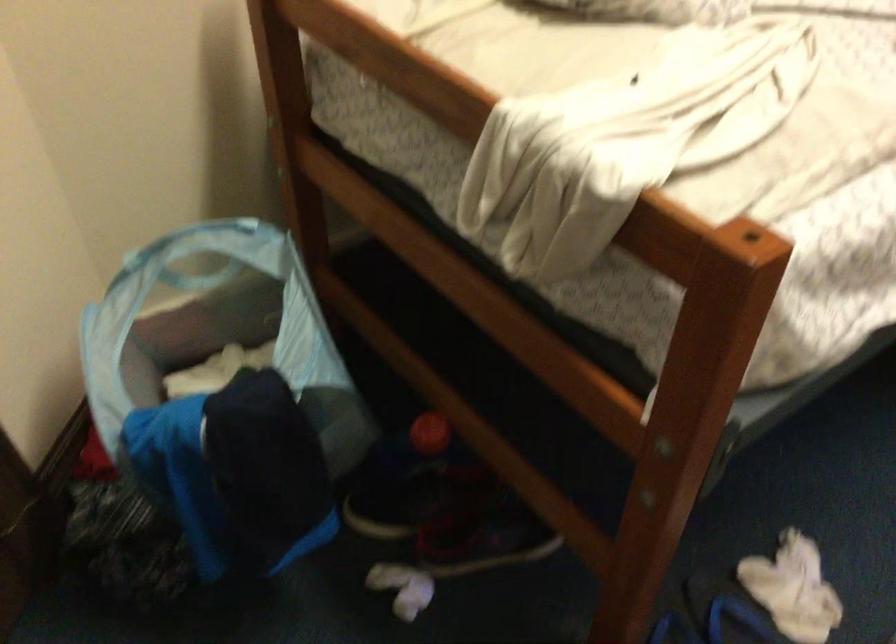
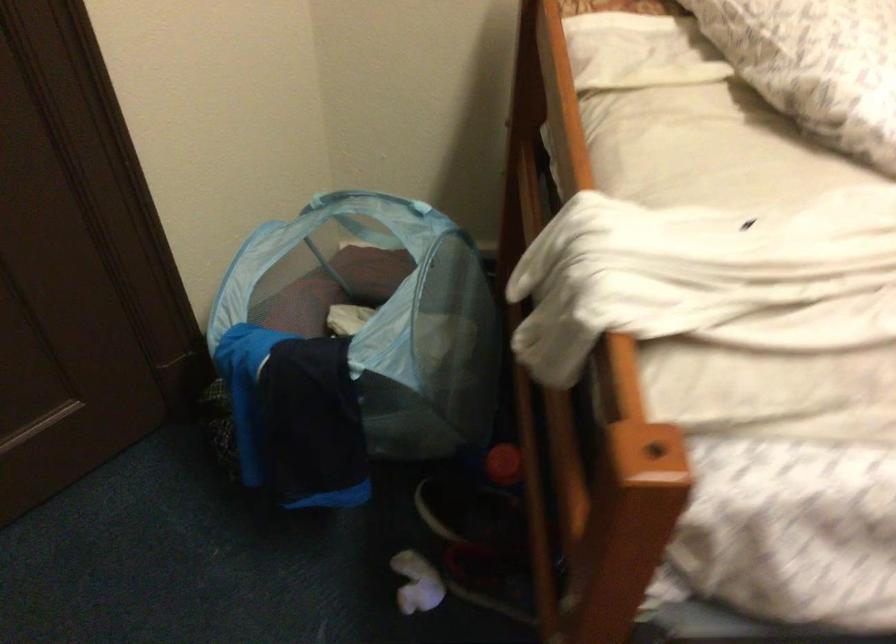
Locate, in the second image, the point that corresponds to point 409,496 in the first image.

(469, 509)